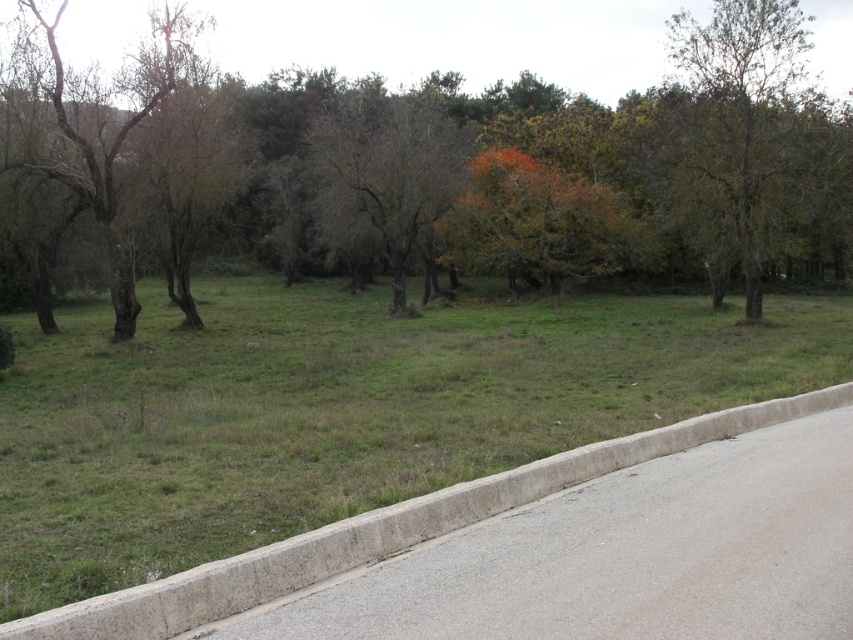
You are standing at the center of the paved road in the image. You see a point marked at coordinates (753, 134). Which object in the scene is this point located on?

The point at coordinates (753, 134) is located on the brown rough tree at upper right.

You are a gardener planning to plant a new tree in the grassy field. The brown textured tree at center and the bare branches at left are existing trees. Which existing tree has a larger canopy area?

The bare branches at left has a larger canopy area since it is bigger than the brown textured tree at center.